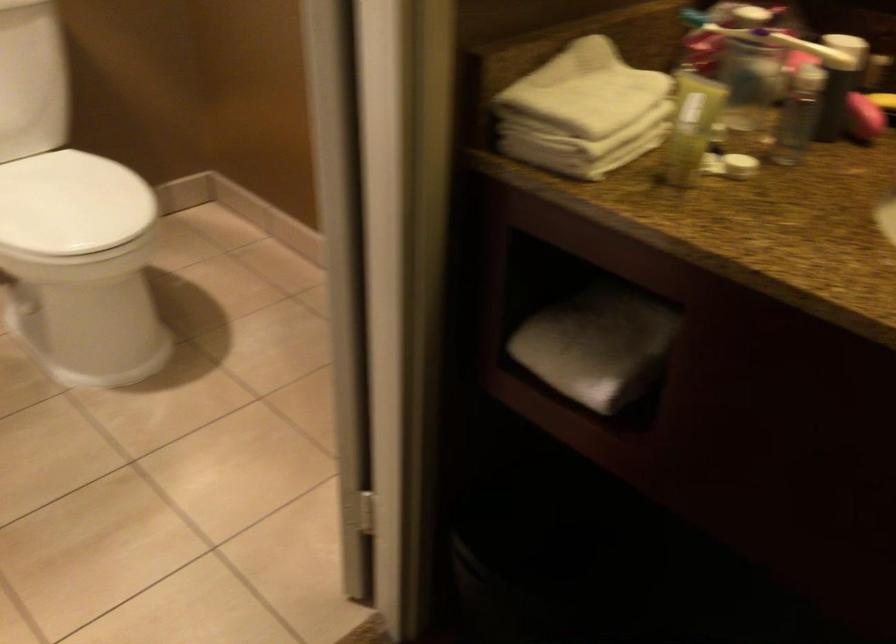
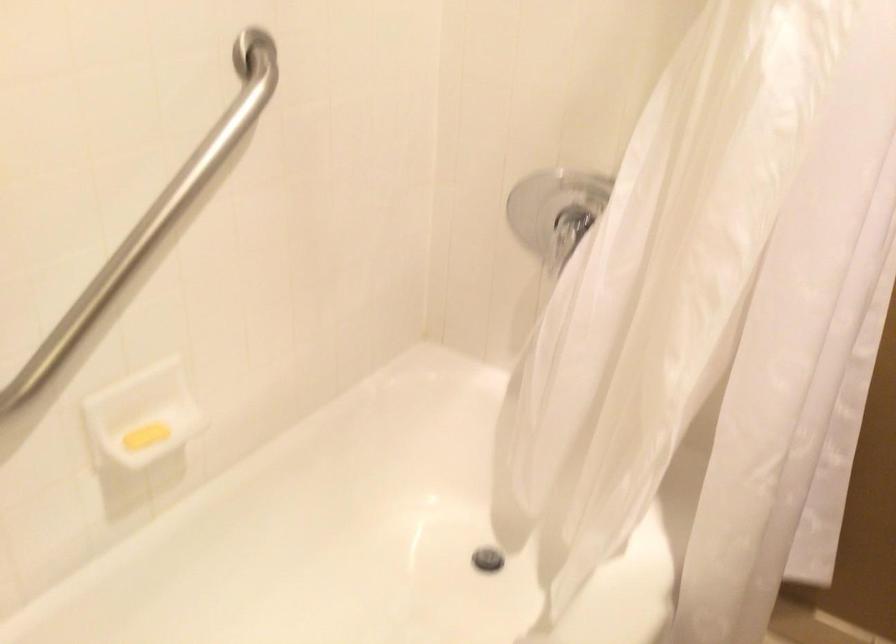
Question: The camera is either moving clockwise (left) or counter-clockwise (right) around the object. The first image is from the beginning of the video and the second image is from the end. Is the camera moving left or right when shooting the video?

Choices:
 (A) Left
 (B) Right

Answer: (B)